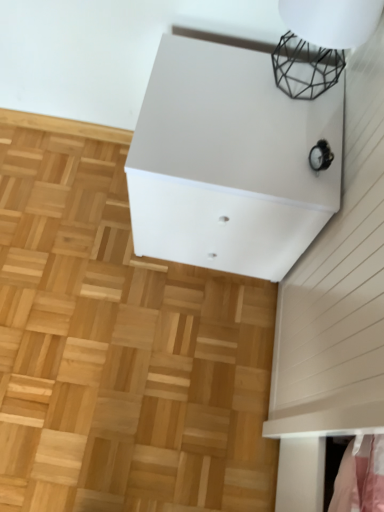
Where is `free location in front of black wire mesh at upper right`? The image size is (384, 512). free location in front of black wire mesh at upper right is located at coordinates (284, 140).